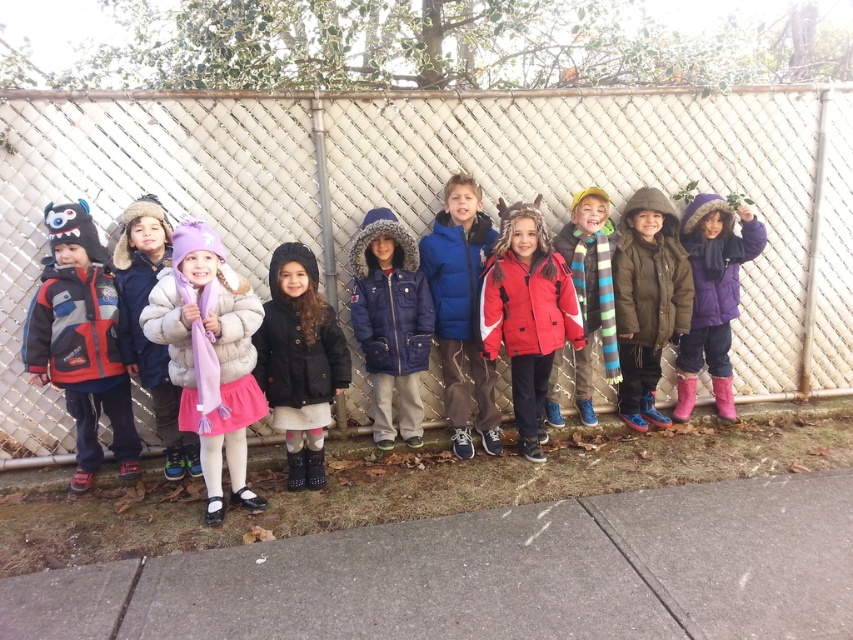
Question: Among these points, which one is nearest to the camera?

Choices:
 (A) (144, 268)
 (B) (805, 288)
 (C) (622, 330)
 (D) (421, 321)

Answer: (A)

Question: Can you confirm if black wool coat at center is positioned above purple fuzzy coat at right?

Choices:
 (A) yes
 (B) no

Answer: (B)

Question: Is fuzzy pink coat at center wider than striped scarf at center?

Choices:
 (A) no
 (B) yes

Answer: (A)

Question: Estimate the real-world distances between objects in this image. Which object is farther from the matte brown jacket at center?

Choices:
 (A) matte red and blue jacket at left
 (B) red matte jacket at center
 (C) fuzzy pink coat at center

Answer: (A)

Question: Can you confirm if metallic chain-link fence at center is positioned below matte red and blue jacket at left?

Choices:
 (A) no
 (B) yes

Answer: (A)

Question: Which object is closer to the camera taking this photo?

Choices:
 (A) puffy white coat at center
 (B) metallic chain-link fence at center

Answer: (A)